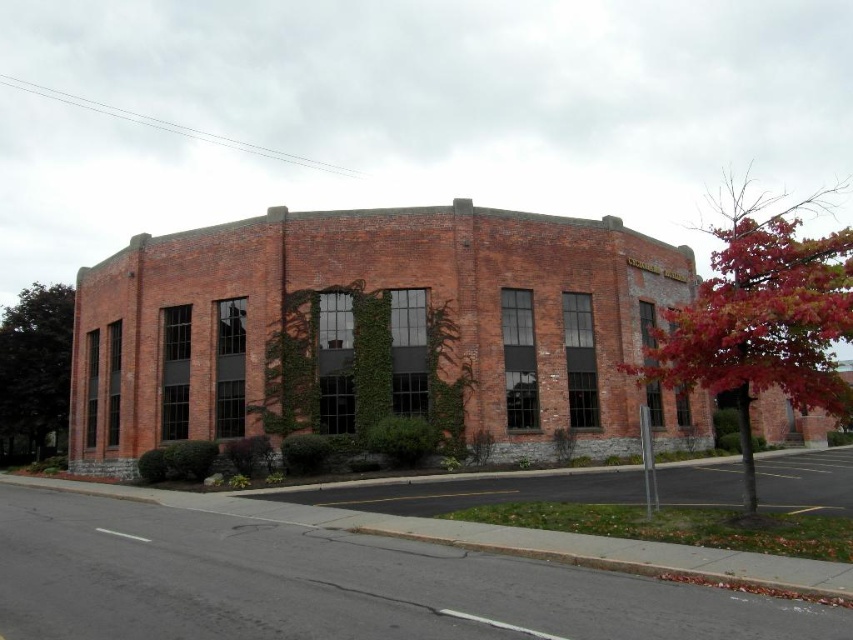
Based on the photo, can you confirm if red leafy tree at right is thinner than green leafy tree at left?

No.

Who is more distant from viewer, (846,272) or (47,384)?

Point (47,384)

Between point (827, 204) and point (12, 323), which one is positioned in front?

Point (12, 323)

Find the location of `red leafy tree at right`. red leafy tree at right is located at coordinates (761, 316).